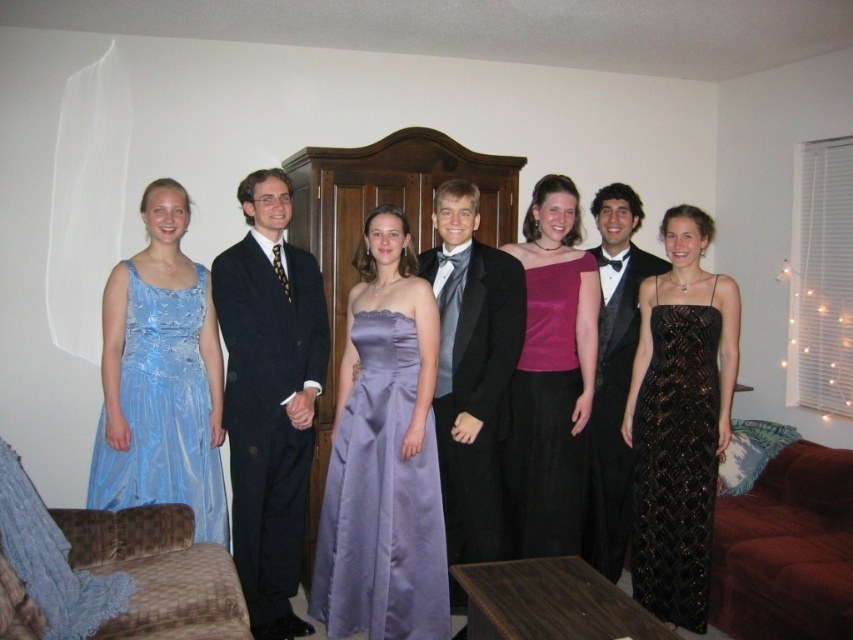
You are a photographer setting up for a group photo. You need to arrange the subjects so that the purple satin dress at center and the black sequined dress at center are visible to the audience. Given their sizes, which dress should be placed slightly forward to ensure both are fully visible?

The purple satin dress at center is larger than the black sequined dress at center, so placing the black sequined dress at center slightly forward will ensure both dresses are fully visible to the audience.

You are standing at the camera position and want to take a closer photo of the purple satin dress at center. If you move forward 5 feet, will you be able to get a closer shot?

The purple satin dress at center is currently 9.20 feet away from the camera. Moving forward 5 feet would bring you to 4.20 feet away, allowing for a closer shot.

Consider the image. Which object is positioned to the right of the other between the shiny black suit at center and the shiny blue dress at left?

The shiny black suit at center is positioned to the right of the shiny blue dress at left.